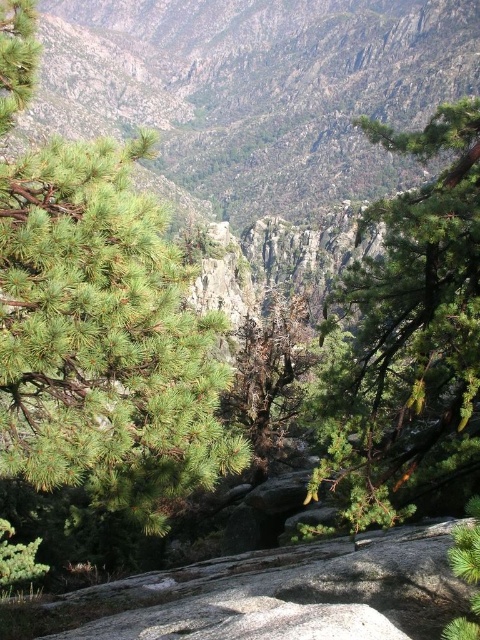
Who is shorter, green textured mountain at upper center or green needle-like tree at center?

With less height is green needle-like tree at center.

Is green textured mountain at upper center smaller than green needle-like tree at center?

Incorrect, green textured mountain at upper center is not smaller in size than green needle-like tree at center.

Which is in front, point (264, 154) or point (340, 392)?

Positioned in front is point (340, 392).

Find the location of a particular element. green textured mountain at upper center is located at coordinates (257, 88).

Is green needle-like at center shorter than green needle-like tree at center?

Indeed, green needle-like at center has a lesser height compared to green needle-like tree at center.

From the picture: Can you confirm if green needle-like at center is positioned to the right of green needle-like tree at center?

Incorrect, green needle-like at center is not on the right side of green needle-like tree at center.

Does point (28, 264) come farther from viewer compared to point (359, 378)?

That is False.

The width and height of the screenshot is (480, 640). Find the location of `green needle-like at center`. green needle-like at center is located at coordinates click(x=103, y=337).

Does green needle-like at center appear on the left side of green textured mountain at upper center?

In fact, green needle-like at center is to the right of green textured mountain at upper center.

Between point (123, 380) and point (348, 192), which one is positioned behind?

Point (348, 192)

Is point (223, 365) less distant than point (349, 168)?

Yes, it is.

The height and width of the screenshot is (640, 480). In order to click on green needle-like at center in this screenshot , I will do `click(103, 337)`.